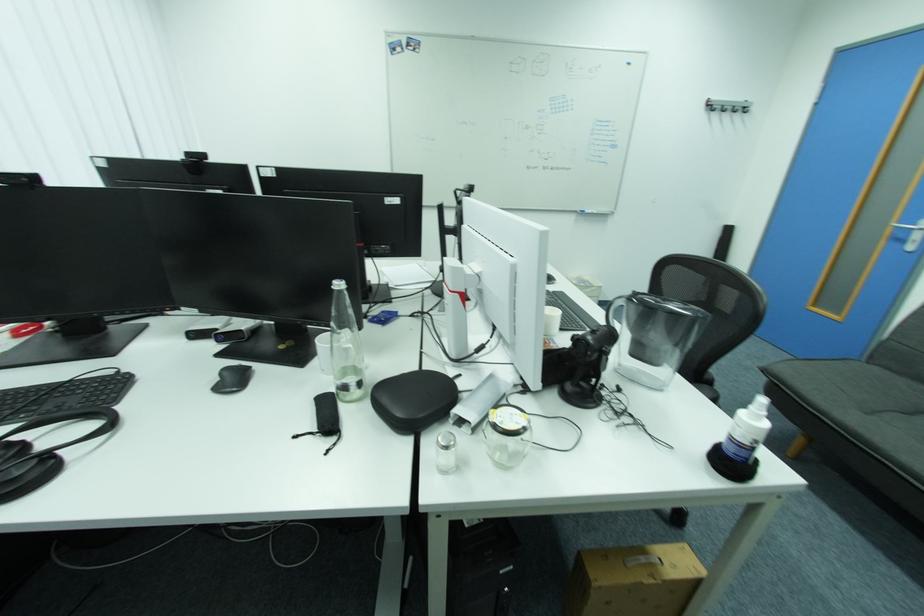
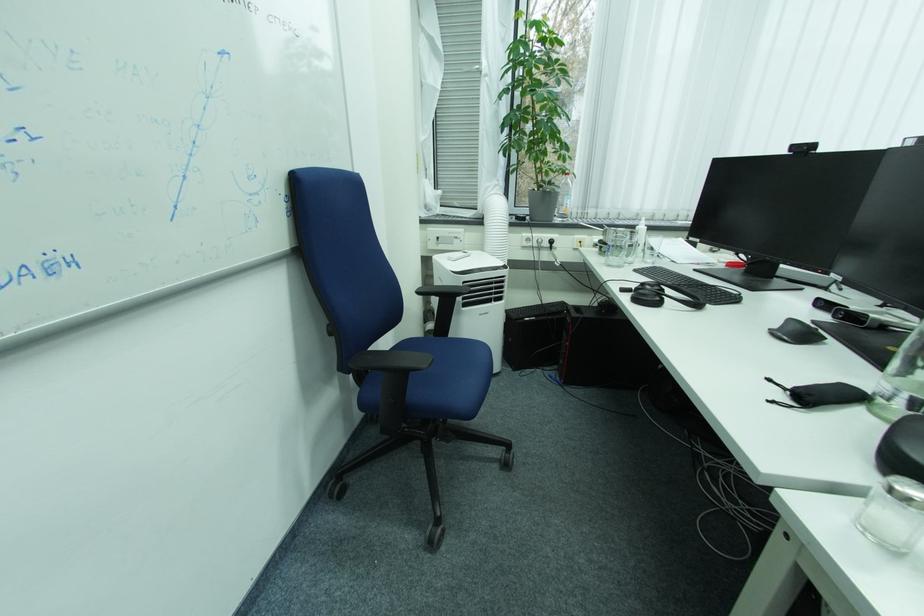
Based on the photo, the first image is from the beginning of the video and the second image is from the end. How did the camera likely rotate when shooting the video?

The rotation direction of the camera is left-down.